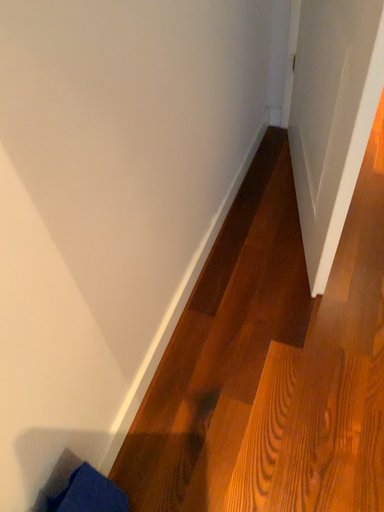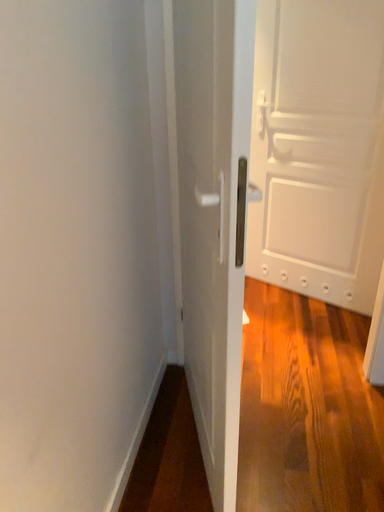
Question: Which way did the camera rotate in the video?

Choices:
 (A) rotated right
 (B) rotated left

Answer: (A)